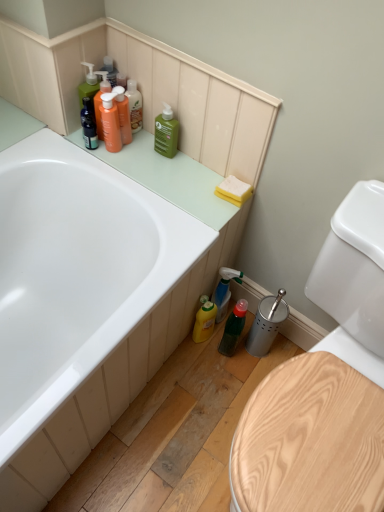
Question: From the image's perspective, is translucent green spray bottle at lower right, arranged as the third cleaning product when viewed from the top, positioned above or below green matte bottle at upper center, the 3th cleaning product positioned from the bottom?

Choices:
 (A) below
 (B) above

Answer: (A)

Question: Looking at the image, does translucent green spray bottle at lower right, which is the second cleaning product from bottom to top, seem bigger or smaller compared to green matte bottle at upper center, which appears as the 2th cleaning product when viewed from the top?

Choices:
 (A) small
 (B) big

Answer: (B)

Question: Estimate the real-world distances between objects in this image. Which object is farther from the white glossy bathtub at upper left?

Choices:
 (A) translucent orange bottle at upper left, which ranks as the first cleaning product in left-to-right order
 (B) yellow sponge at upper right
 (C) green matte bottle at upper center, which appears as the 2th cleaning product when viewed from the top
 (D) translucent orange bottles at upper left, arranged as the 1th toiletry when ordered from the bottom
 (E) wooden toilet seat at lower right

Answer: (E)

Question: Estimate the real-world distances between objects in this image. Which object is closer to the wooden toilet seat at lower right?

Choices:
 (A) green matte bottle at lower center
 (B) yellow matte bottle at lower center, the second cleaning product positioned from the right
 (C) green matte bottle at upper center, the second cleaning product in the left-to-right sequence
 (D) translucent orange bottles at upper left, which ranks as the second toiletry in top-to-bottom order
 (E) white glossy bathtub at upper left

Answer: (A)